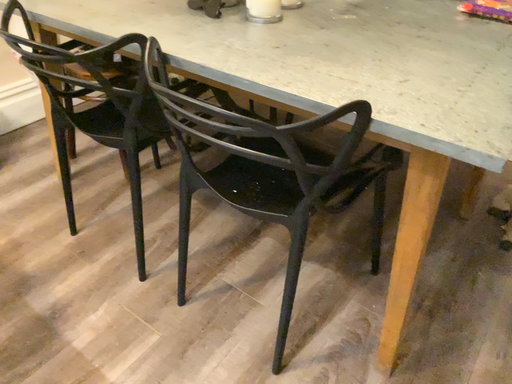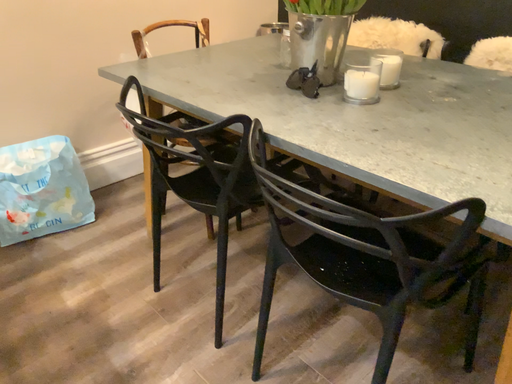
Question: How did the camera likely rotate when shooting the video?

Choices:
 (A) rotated left
 (B) rotated right

Answer: (A)